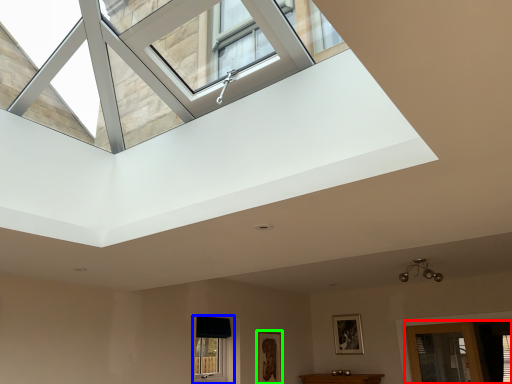
Question: Considering the real-world distances, which object is farthest from glass door (highlighted by a red box)? window (highlighted by a blue box) or picture frame (highlighted by a green box)?

Choices:
 (A) window
 (B) picture frame

Answer: (A)